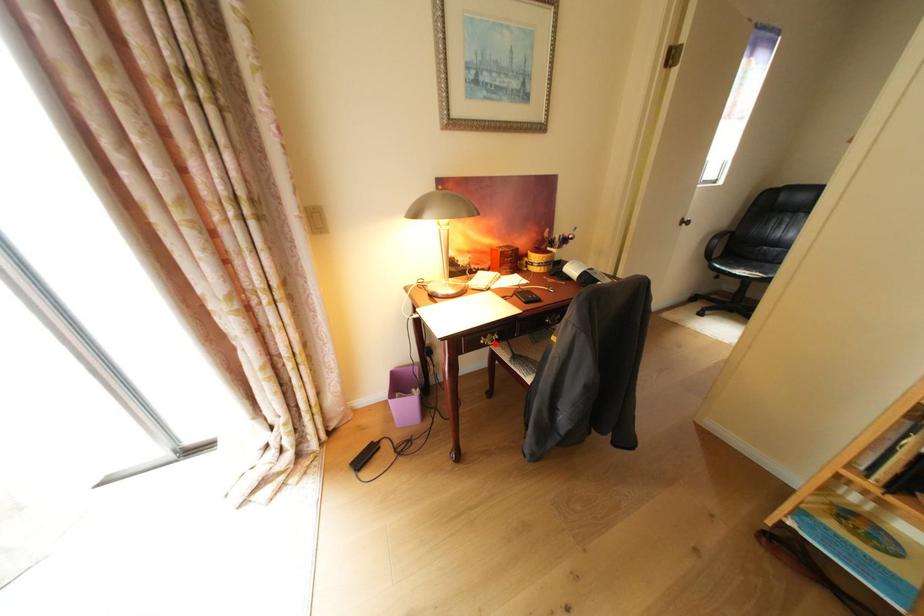
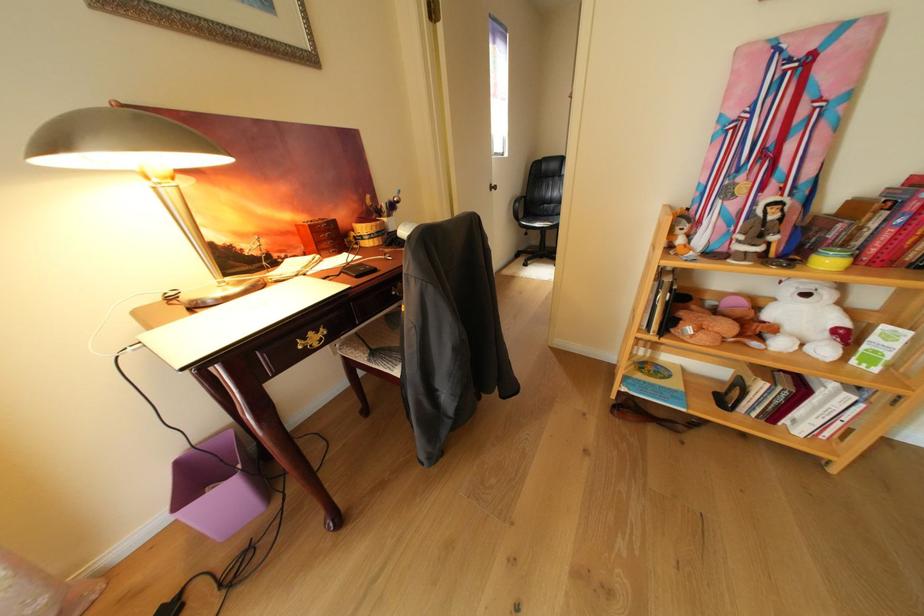
Question: I am providing you with two images of the same scene from different viewpoints. A red point is shown in image1. For the corresponding object point in image2, is it positioned nearer or farther from the camera?

Choices:
 (A) Nearer
 (B) Farther

Answer: (A)